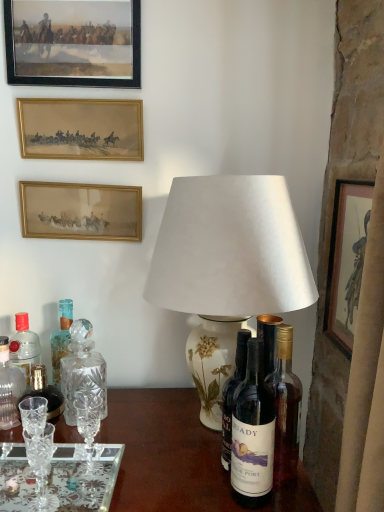
Question: Considering the relative positions of wooden frame at upper left, the fourth picture frame when ordered from bottom to top, and wooden framed print at right, acting as the 4th picture frame starting from the left, in the image provided, is wooden frame at upper left, the fourth picture frame when ordered from bottom to top, to the left of wooden framed print at right, acting as the 4th picture frame starting from the left, from the viewer's perspective?

Choices:
 (A) yes
 (B) no

Answer: (A)

Question: Can you confirm if wooden frame at upper left, positioned as the 1th picture frame in left-to-right order, is taller than wooden framed print at right, the fourth picture frame from the top?

Choices:
 (A) yes
 (B) no

Answer: (B)

Question: Is wooden frame at upper left, the fourth picture frame when ordered from bottom to top, to the right of wooden framed print at right, the fourth picture frame from the top, from the viewer's perspective?

Choices:
 (A) no
 (B) yes

Answer: (A)

Question: Can you confirm if wooden frame at upper left, positioned as the 1th picture frame in left-to-right order, is wider than wooden framed print at right, marked as the 1th picture frame in a bottom-to-top arrangement?

Choices:
 (A) yes
 (B) no

Answer: (A)

Question: From the image's perspective, is wooden frame at upper left, the fourth picture frame when ordered from bottom to top, under wooden framed print at right, which is the first picture frame in right-to-left order?

Choices:
 (A) no
 (B) yes

Answer: (A)

Question: Is wooden frame at upper left, positioned as the fourth picture frame in right-to-left order, oriented towards wooden framed print at right, which is the first picture frame in right-to-left order?

Choices:
 (A) yes
 (B) no

Answer: (B)

Question: Considering the relative sizes of translucent glass bottle at left, the 4th bottle positioned from the front, and dark glass bottle at center, placed as the 4th bottle when sorted from back to front, in the image provided, is translucent glass bottle at left, the 4th bottle positioned from the front, bigger than dark glass bottle at center, placed as the 4th bottle when sorted from back to front,?

Choices:
 (A) yes
 (B) no

Answer: (B)

Question: Can you confirm if translucent glass bottle at left, the 3th bottle in the right-to-left sequence, is shorter than dark glass bottle at center, placed as the 4th bottle when sorted from back to front?

Choices:
 (A) yes
 (B) no

Answer: (A)

Question: From a real-world perspective, is translucent glass bottle at left, the 2th bottle in the left-to-right sequence, beneath dark glass bottle at center, which ranks as the 1th bottle in front-to-back order?

Choices:
 (A) yes
 (B) no

Answer: (A)

Question: Is translucent glass bottle at left, the 3th bottle in the right-to-left sequence, positioned with its back to dark glass bottle at center, the 1th bottle positioned from the right?

Choices:
 (A) yes
 (B) no

Answer: (B)

Question: From the image's perspective, does translucent glass bottle at left, which is the 1th bottle from back to front, appear lower than dark glass bottle at center, the 1th bottle positioned from the right?

Choices:
 (A) yes
 (B) no

Answer: (B)

Question: Is translucent glass bottle at left, the 3th bottle in the right-to-left sequence, at the left side of dark glass bottle at center, placed as the 4th bottle when sorted from back to front?

Choices:
 (A) no
 (B) yes

Answer: (B)

Question: Considering the relative sizes of wooden frame at upper left, the fourth picture frame when ordered from bottom to top, and clear glass decanter at left, acting as the fourth bottle starting from the right, in the image provided, is wooden frame at upper left, the fourth picture frame when ordered from bottom to top, wider than clear glass decanter at left, acting as the fourth bottle starting from the right,?

Choices:
 (A) yes
 (B) no

Answer: (B)